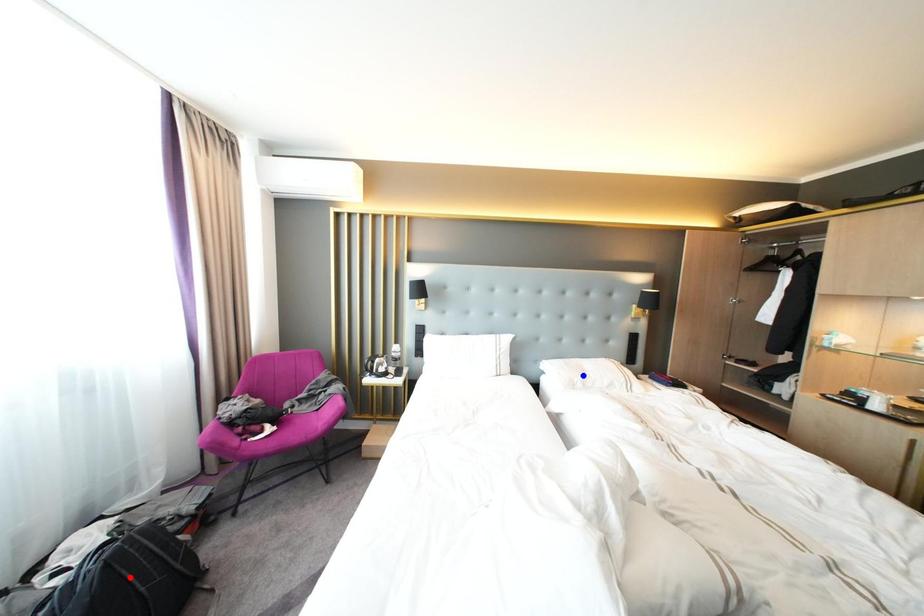
Question: In the image, two points are highlighted. Which point is nearer to the camera? Reply with the corresponding letter.

Choices:
 (A) blue point
 (B) red point

Answer: (B)